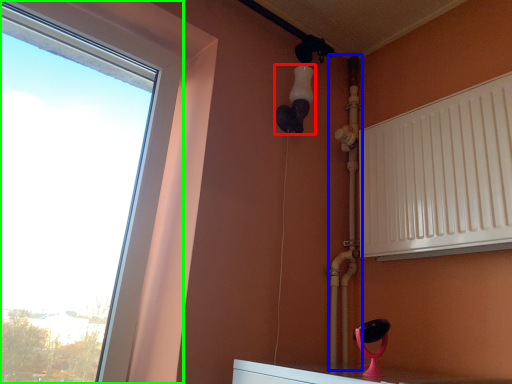
Question: Estimate the real-world distances between objects in this image. Which object is farther from light fixture (highlighted by a red box), pipe (highlighted by a blue box) or window (highlighted by a green box)?

Choices:
 (A) pipe
 (B) window

Answer: (B)